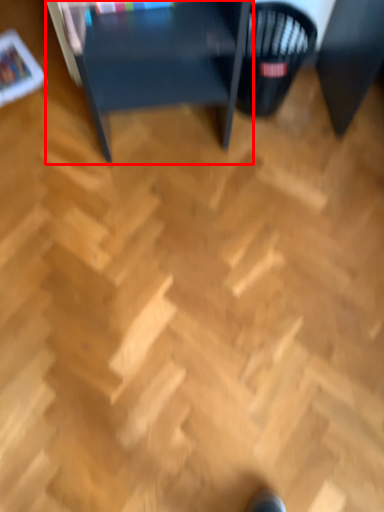
Question: In this image, where is table (annotated by the red box) located relative to basket?

Choices:
 (A) right
 (B) left

Answer: (B)